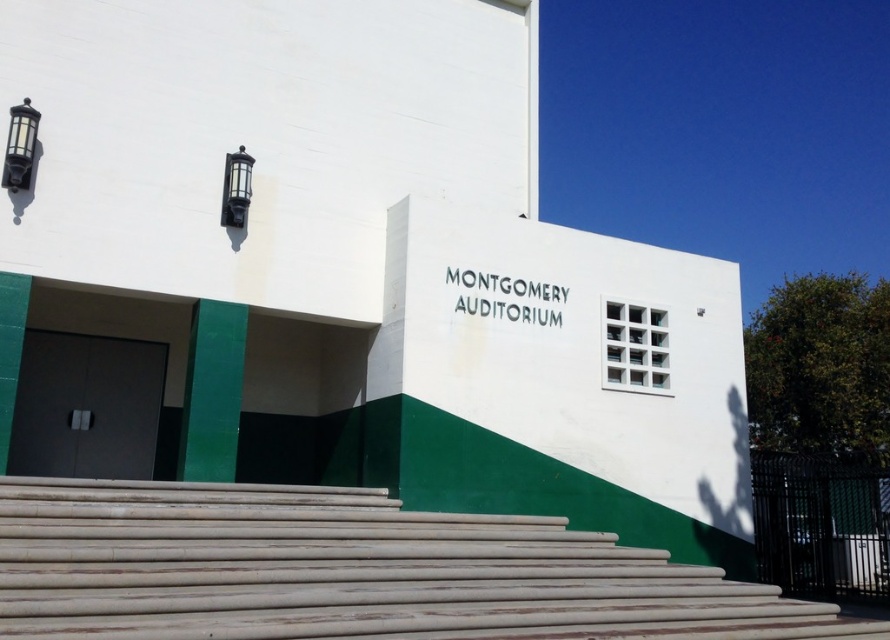
Between wooden at center and matte black door at left, which one appears on the right side from the viewer's perspective?

wooden at center

Who is lower down, wooden at center or matte black door at left?

wooden at center is below.

Is point (524, 580) more distant than point (114, 394)?

No, (524, 580) is closer to viewer.

This screenshot has height=640, width=890. What are the coordinates of `wooden at center` in the screenshot? It's located at (350, 572).